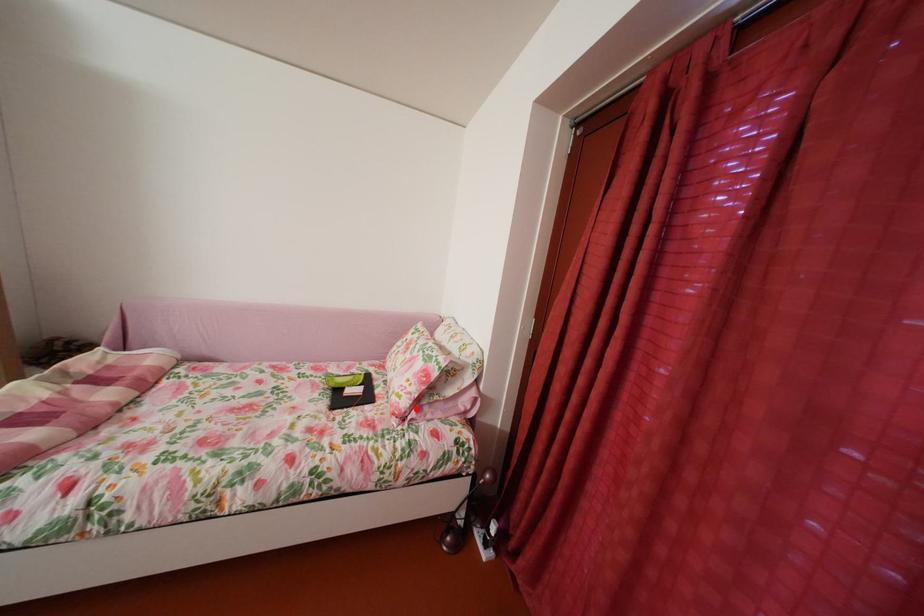
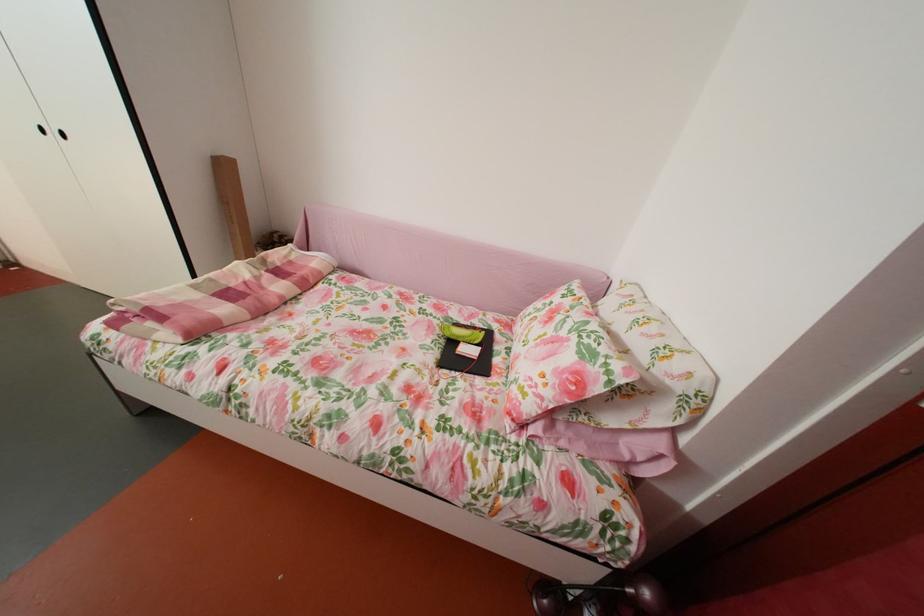
Find the pixel in the second image that matches the highlighted location in the first image.

(541, 413)